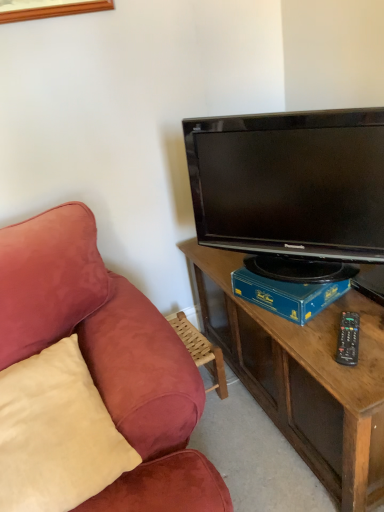
Question: Based on their positions, is blue cardboard box at center located to the left or right of beige suede pillow at left?

Choices:
 (A) right
 (B) left

Answer: (A)

Question: From a real-world perspective, is blue cardboard box at center physically located above or below beige suede pillow at left?

Choices:
 (A) below
 (B) above

Answer: (B)

Question: Which object is the closest to the beige suede pillow at left?

Choices:
 (A) black plastic remote control at right
 (B) black glossy tv at upper right
 (C) blue cardboard box at center

Answer: (C)

Question: Which object is the closest to the black glossy tv at upper right?

Choices:
 (A) beige suede pillow at left
 (B) black plastic remote control at right
 (C) blue cardboard box at center

Answer: (C)